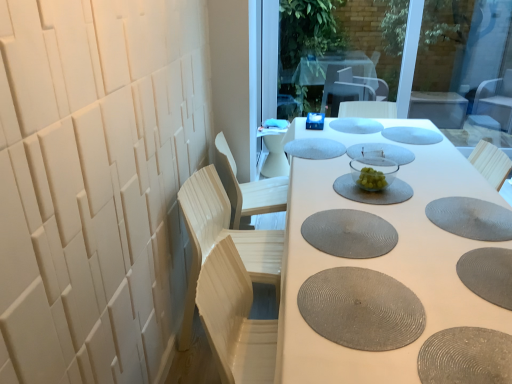
Where is `vacant area situated to the left side of gray textured placemat at lower right, the eighth manhole cover in the back-to-front sequence`? vacant area situated to the left side of gray textured placemat at lower right, the eighth manhole cover in the back-to-front sequence is located at coordinates (421, 287).